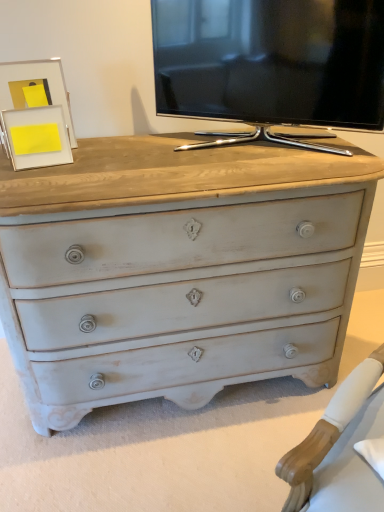
Question: From the image's perspective, is matte white picture frame at upper left, positioned as the second picture frame in front-to-back order, beneath black glossy tv at upper center?

Choices:
 (A) yes
 (B) no

Answer: (A)

Question: Does matte white picture frame at upper left, positioned as the 1th picture frame in back-to-front order, turn towards black glossy tv at upper center?

Choices:
 (A) no
 (B) yes

Answer: (A)

Question: From a real-world perspective, is matte white picture frame at upper left, positioned as the 1th picture frame in back-to-front order, over black glossy tv at upper center?

Choices:
 (A) yes
 (B) no

Answer: (B)

Question: Is there a large distance between matte white picture frame at upper left, positioned as the 1th picture frame in back-to-front order, and black glossy tv at upper center?

Choices:
 (A) yes
 (B) no

Answer: (B)

Question: Can you confirm if matte white picture frame at upper left, positioned as the second picture frame in front-to-back order, is wider than black glossy tv at upper center?

Choices:
 (A) yes
 (B) no

Answer: (B)

Question: Is matte white picture frame at upper left, positioned as the 1th picture frame in back-to-front order, smaller than black glossy tv at upper center?

Choices:
 (A) yes
 (B) no

Answer: (A)

Question: From the image's perspective, is matte white picture frame at upper left, positioned as the 1th picture frame in front-to-back order, located beneath matte white picture frame at upper left, positioned as the second picture frame in front-to-back order?

Choices:
 (A) no
 (B) yes

Answer: (B)

Question: Is matte white picture frame at upper left, which appears as the second picture frame when viewed from the back, beside matte white picture frame at upper left, positioned as the 1th picture frame in back-to-front order?

Choices:
 (A) yes
 (B) no

Answer: (A)

Question: Does matte white picture frame at upper left, which appears as the second picture frame when viewed from the back, turn towards matte white picture frame at upper left, positioned as the second picture frame in front-to-back order?

Choices:
 (A) yes
 (B) no

Answer: (B)

Question: Is matte white picture frame at upper left, positioned as the 1th picture frame in front-to-back order, smaller than matte white picture frame at upper left, positioned as the 1th picture frame in back-to-front order?

Choices:
 (A) no
 (B) yes

Answer: (B)

Question: Are matte white picture frame at upper left, positioned as the 1th picture frame in front-to-back order, and matte white picture frame at upper left, positioned as the 1th picture frame in back-to-front order, far apart?

Choices:
 (A) no
 (B) yes

Answer: (A)

Question: Is matte white picture frame at upper left, which appears as the second picture frame when viewed from the back, to the right of matte white picture frame at upper left, positioned as the 1th picture frame in back-to-front order, from the viewer's perspective?

Choices:
 (A) no
 (B) yes

Answer: (B)

Question: Does matte white picture frame at upper left, positioned as the second picture frame in front-to-back order, appear on the left side of matte white picture frame at upper left, positioned as the 1th picture frame in front-to-back order?

Choices:
 (A) yes
 (B) no

Answer: (A)